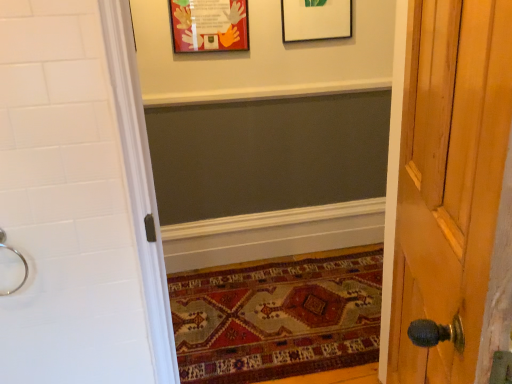
Question: Is silver metallic ring at left completely or partially inside white matte picture frame at upper center, which ranks as the 1th picture frame in right-to-left order?

Choices:
 (A) yes
 (B) no

Answer: (B)

Question: From a real-world perspective, is white matte picture frame at upper center, which is the second picture frame from left to right, below silver metallic ring at left?

Choices:
 (A) no
 (B) yes

Answer: (A)

Question: Considering the relative sizes of white matte picture frame at upper center, which is the second picture frame from left to right, and silver metallic ring at left in the image provided, is white matte picture frame at upper center, which is the second picture frame from left to right, bigger than silver metallic ring at left?

Choices:
 (A) yes
 (B) no

Answer: (A)

Question: From the image's perspective, is white matte picture frame at upper center, which ranks as the 1th picture frame in right-to-left order, under silver metallic ring at left?

Choices:
 (A) no
 (B) yes

Answer: (A)

Question: Considering the relative sizes of white matte picture frame at upper center, which ranks as the 1th picture frame in right-to-left order, and silver metallic ring at left in the image provided, is white matte picture frame at upper center, which ranks as the 1th picture frame in right-to-left order, smaller than silver metallic ring at left?

Choices:
 (A) no
 (B) yes

Answer: (A)

Question: Considering the relative sizes of white matte picture frame at upper center, which ranks as the 1th picture frame in right-to-left order, and silver metallic ring at left in the image provided, is white matte picture frame at upper center, which ranks as the 1th picture frame in right-to-left order, taller than silver metallic ring at left?

Choices:
 (A) no
 (B) yes

Answer: (B)

Question: From the image's perspective, is carpeted mat at lower center below white matte picture frame at upper center, which is the second picture frame from left to right?

Choices:
 (A) yes
 (B) no

Answer: (A)

Question: Is carpeted mat at lower center thinner than white matte picture frame at upper center, which is the second picture frame from left to right?

Choices:
 (A) no
 (B) yes

Answer: (A)

Question: Is the depth of carpeted mat at lower center less than that of white matte picture frame at upper center, which ranks as the 1th picture frame in right-to-left order?

Choices:
 (A) yes
 (B) no

Answer: (A)

Question: From a real-world perspective, is carpeted mat at lower center under white matte picture frame at upper center, which is the second picture frame from left to right?

Choices:
 (A) yes
 (B) no

Answer: (A)

Question: Is carpeted mat at lower center aimed at white matte picture frame at upper center, which is the second picture frame from left to right?

Choices:
 (A) no
 (B) yes

Answer: (A)

Question: Does carpeted mat at lower center have a greater height compared to white matte picture frame at upper center, which is the second picture frame from left to right?

Choices:
 (A) no
 (B) yes

Answer: (A)

Question: Considering the relative sizes of silver metallic ring at left and white matte picture frame at upper center, which is the second picture frame from left to right, in the image provided, is silver metallic ring at left wider than white matte picture frame at upper center, which is the second picture frame from left to right,?

Choices:
 (A) yes
 (B) no

Answer: (A)